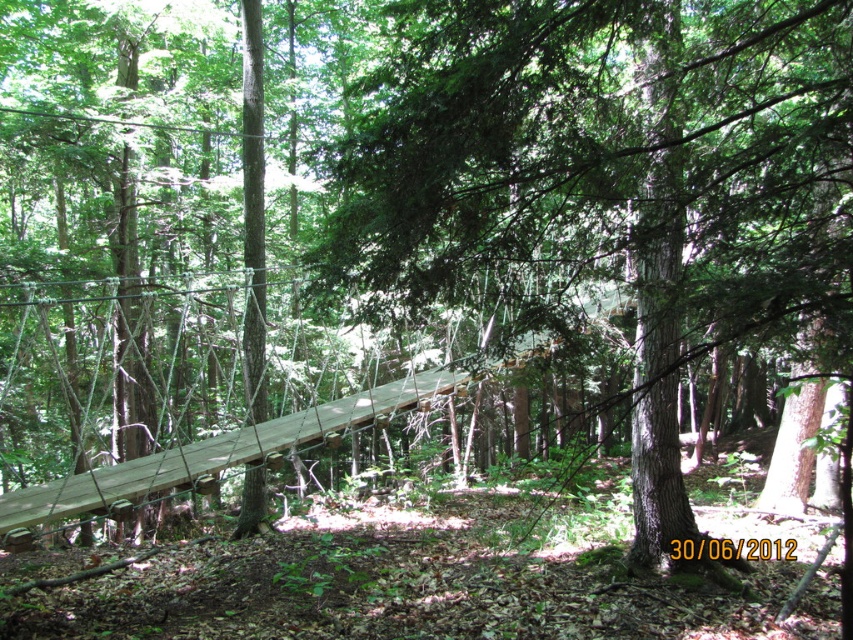
Question: Is brown wood bridge at center positioned in front of wooden plank bridge at center?

Choices:
 (A) yes
 (B) no

Answer: (A)

Question: Can you confirm if brown wood bridge at center is smaller than wooden plank bridge at center?

Choices:
 (A) yes
 (B) no

Answer: (A)

Question: Where is brown wood bridge at center located in relation to wooden plank bridge at center in the image?

Choices:
 (A) left
 (B) right

Answer: (B)

Question: Which point is closer to the camera taking this photo?

Choices:
 (A) (488, 144)
 (B) (529, 355)

Answer: (A)